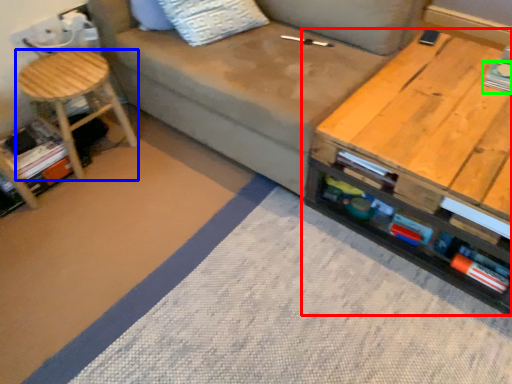
Question: Which is nearer to the table (highlighted by a red box)? stool (highlighted by a blue box) or book (highlighted by a green box).

Choices:
 (A) stool
 (B) book

Answer: (B)